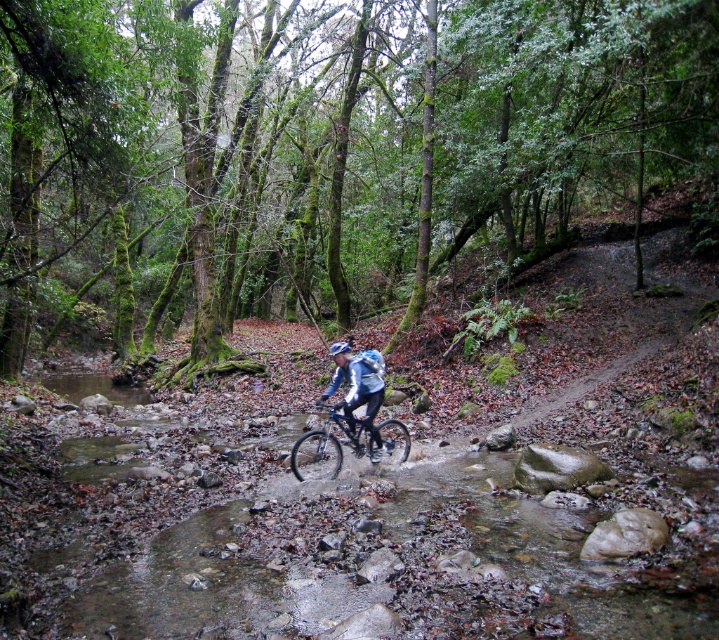
You are a photographer aiming to capture the entire scene of the green mossy trees at center and the matte blue jacket at center in a single shot. Based on their widths, which object would require you to adjust your camera angle to ensure both fit in the frame?

The green mossy trees at center have a greater width than the matte blue jacket at center, so you would need to adjust your camera angle to accommodate their wider size to ensure both fit in the frame.

You are standing at point A, which is at coordinates (x=349, y=392). You want to walk to a point that is 9.01 meters away from your current position. Can you reach the cyclist riding a mountain bike across the shallow stream in that distance?

Yes, the cyclist riding a mountain bike across the shallow stream is 9.01 meters away from point A at coordinates (x=349, y=392), so you can reach them within that distance.

You are a photographer trying to capture the cyclist in action. You notice the shiny metallic bicycle at center and the matte blue helmet at center in your viewfinder. Which object is closer to the camera?

The shiny metallic bicycle at center is positioned under the matte blue helmet at center, meaning the helmet is closer to the camera.